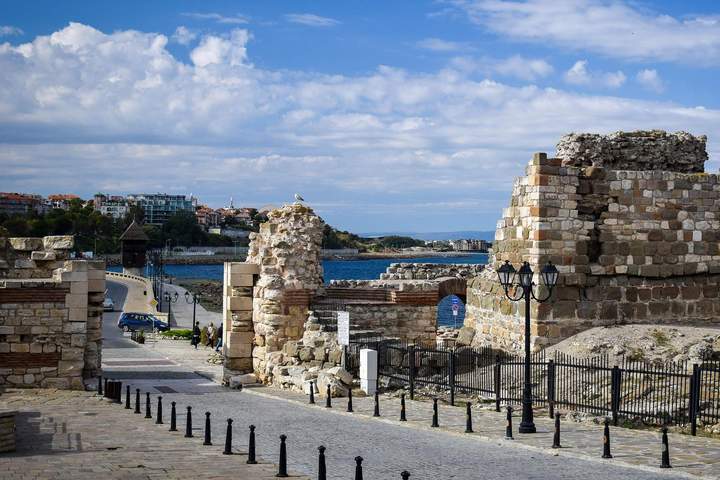
What are the coordinates of `lights` in the screenshot? It's located at (525, 281), (505, 276), (551, 278), (199, 298).